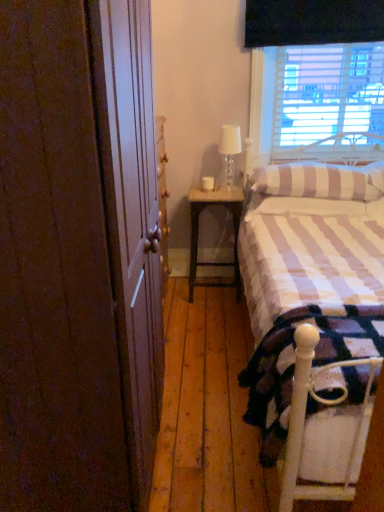
The width and height of the screenshot is (384, 512). Find the location of `vacant region in front of translucent glass table lamp at upper right`. vacant region in front of translucent glass table lamp at upper right is located at coordinates coord(233,190).